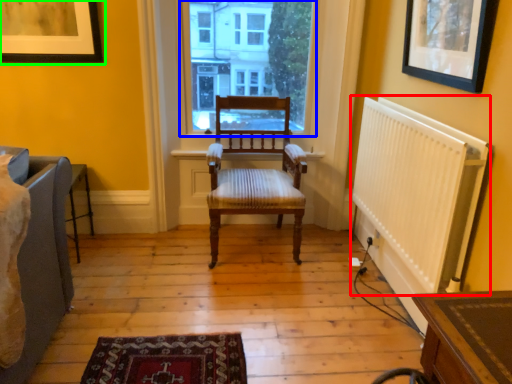
Question: Which object is the closest to the radiator (highlighted by a red box)? Choose among these: window (highlighted by a blue box) or picture frame (highlighted by a green box).

Choices:
 (A) window
 (B) picture frame

Answer: (A)